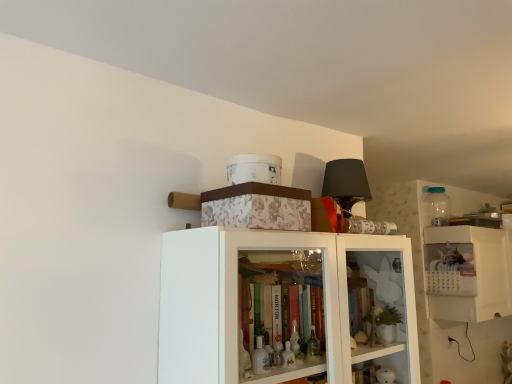
Question: Is white plastic calendar at upper right bigger or smaller than white floral-patterned box at upper center?

Choices:
 (A) big
 (B) small

Answer: (A)

Question: Do you think white plastic calendar at upper right is within white floral-patterned box at upper center, or outside of it?

Choices:
 (A) inside
 (B) outside

Answer: (B)

Question: Which is farther from the transparent plastic bottle at upper right?

Choices:
 (A) white plastic calendar at upper right
 (B) white floral-patterned box at upper center

Answer: (B)

Question: Considering the real-world distances, which object is closest to the white plastic calendar at upper right?

Choices:
 (A) white floral-patterned box at upper center
 (B) transparent plastic bottle at upper right

Answer: (B)